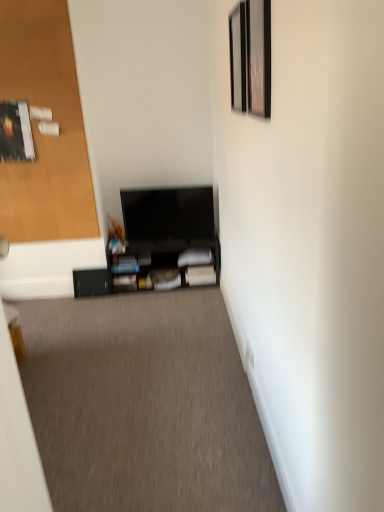
Measure the distance between wooden picture frame at upper right, placed as the 2th picture frame when sorted from front to back, and camera.

The distance of wooden picture frame at upper right, placed as the 2th picture frame when sorted from front to back, from camera is 1.82 meters.

This screenshot has height=512, width=384. Describe the element at coordinates (144, 405) in the screenshot. I see `black matte tv at center` at that location.

In order to face black matte tv at center, should I rotate leftwards or rightwards?

A 13.364 degree turn to the left will do.

The height and width of the screenshot is (512, 384). In order to click on metallic silver picture frame at upper right, acting as the 1th picture frame starting from the front in this screenshot , I will do `click(259, 57)`.

What do you see at coordinates (91, 283) in the screenshot?
I see `black matte shelf at lower center, which is the second shelf in right-to-left order` at bounding box center [91, 283].

You are a GUI agent. You are given a task and a screenshot of the screen. Output one action in this format:
    pyautogui.click(x=<x>, y=<y>)
    Task: Click on the black matte shelf at lower center, which is the second shelf in right-to-left order
    Image resolution: width=384 pixels, height=512 pixels.
    Given the screenshot: What is the action you would take?
    (91, 283)

Measure the distance between point (14, 13) and camera.

The distance of point (14, 13) from camera is 2.80 meters.

Identify the location of wooden picture frame at upper right, placed as the 2th picture frame when sorted from front to back. This screenshot has height=512, width=384. (238, 57).

How different are the orientations of black matte shelf at lower center, which is the second shelf in right-to-left order, and black matte tv at center in degrees?

They differ by 0.611 degrees in their facing directions.

Looking at their sizes, would you say black matte shelf at lower center, which is the second shelf in right-to-left order, is wider or thinner than black matte tv at center?

black matte shelf at lower center, which is the second shelf in right-to-left order, is thinner than black matte tv at center.

Which of these two, black matte shelf at lower center, which is the second shelf in right-to-left order, or black matte tv at center, stands taller?

Standing taller between the two is black matte shelf at lower center, which is the second shelf in right-to-left order.

This screenshot has width=384, height=512. What are the coordinates of `plain located below the black matte shelf at lower center, acting as the 1th shelf starting from the left (from the image's perspective)` in the screenshot? It's located at (144, 405).

Is wooden door at left with black matte shelf at lower center, acting as the 1th shelf starting from the left?

No, wooden door at left is not beside black matte shelf at lower center, acting as the 1th shelf starting from the left.

How different are the orientations of wooden door at left and black matte shelf at lower center, acting as the 1th shelf starting from the left, in degrees?

There is a 1.6-degree angle between the facing directions of wooden door at left and black matte shelf at lower center, acting as the 1th shelf starting from the left.

Which of these two, wooden door at left or black matte shelf at lower center, acting as the 1th shelf starting from the left, is wider?

black matte shelf at lower center, acting as the 1th shelf starting from the left.

Is wooden door at left taller or shorter than black matte shelf at lower center, which is the second shelf in right-to-left order?

Clearly, wooden door at left is taller compared to black matte shelf at lower center, which is the second shelf in right-to-left order.

Which is closer, [175,428] or [270,33]?

Point [270,33]

Between black matte tv at center and metallic silver picture frame at upper right, acting as the 1th picture frame starting from the front, which one appears on the right side from the viewer's perspective?

From the viewer's perspective, metallic silver picture frame at upper right, acting as the 1th picture frame starting from the front, appears more on the right side.

From a real-world perspective, which is physically below, black matte tv at center or metallic silver picture frame at upper right, acting as the 1th picture frame starting from the front?

black matte tv at center.

Which object is further away from the camera, black matte tv at center or metallic silver picture frame at upper right, acting as the 1th picture frame starting from the front?

black matte tv at center.

Is wooden door at left behind wooden picture frame at upper right, placed as the 2th picture frame when sorted from front to back?

Yes, it is.

From the picture: Is wooden door at left shorter than wooden picture frame at upper right, the 1th picture frame in the back-to-front sequence?

Incorrect, the height of wooden door at left does not fall short of that of wooden picture frame at upper right, the 1th picture frame in the back-to-front sequence.

Is point (30, 74) farther from camera compared to point (230, 27)?

Yes, point (30, 74) is behind point (230, 27).

From the image's perspective, between wooden door at left and wooden picture frame at upper right, placed as the 2th picture frame when sorted from front to back, which one is located above?

wooden door at left appears higher in the image.

From their relative heights in the image, would you say wooden picture frame at upper right, the 1th picture frame in the back-to-front sequence, is taller or shorter than black matte shelf at lower center, which is the second shelf in right-to-left order?

In the image, wooden picture frame at upper right, the 1th picture frame in the back-to-front sequence, appears to be taller than black matte shelf at lower center, which is the second shelf in right-to-left order.

In terms of width, does wooden picture frame at upper right, placed as the 2th picture frame when sorted from front to back, look wider or thinner when compared to black matte shelf at lower center, which is the second shelf in right-to-left order?

Clearly, wooden picture frame at upper right, placed as the 2th picture frame when sorted from front to back, has less width compared to black matte shelf at lower center, which is the second shelf in right-to-left order.

From the image's perspective, is wooden picture frame at upper right, the 1th picture frame in the back-to-front sequence, located beneath black matte shelf at lower center, acting as the 1th shelf starting from the left?

No.

Considering the relative positions of matte black shelf at center, arranged as the 2th shelf when viewed from the left, and wooden door at left in the image provided, is matte black shelf at center, arranged as the 2th shelf when viewed from the left, to the left or to the right of wooden door at left?

matte black shelf at center, arranged as the 2th shelf when viewed from the left, is to the right of wooden door at left.

From the image's perspective, which is above, matte black shelf at center, which is the 1th shelf in right-to-left order, or wooden door at left?

From the image's view, wooden door at left is above.

Is matte black shelf at center, arranged as the 2th shelf when viewed from the left, oriented towards wooden door at left?

No, matte black shelf at center, arranged as the 2th shelf when viewed from the left, is not facing towards wooden door at left.

Considering the relative sizes of matte black shelf at center, which is the 1th shelf in right-to-left order, and wooden door at left in the image provided, is matte black shelf at center, which is the 1th shelf in right-to-left order, taller than wooden door at left?

No.

What's the angular difference between metallic silver picture frame at upper right, placed as the 2th picture frame when sorted from back to front, and wooden picture frame at upper right, the 1th picture frame in the back-to-front sequence,'s facing directions?

The angle between the facing direction of metallic silver picture frame at upper right, placed as the 2th picture frame when sorted from back to front, and the facing direction of wooden picture frame at upper right, the 1th picture frame in the back-to-front sequence, is 0.0146 degrees.

Are metallic silver picture frame at upper right, acting as the 1th picture frame starting from the front, and wooden picture frame at upper right, the 1th picture frame in the back-to-front sequence, located far from each other?

No, metallic silver picture frame at upper right, acting as the 1th picture frame starting from the front, is in close proximity to wooden picture frame at upper right, the 1th picture frame in the back-to-front sequence.

Is metallic silver picture frame at upper right, placed as the 2th picture frame when sorted from back to front, facing towards wooden picture frame at upper right, the 1th picture frame in the back-to-front sequence?

No.

This screenshot has width=384, height=512. Identify the location of shelf on the left side of black matte tv at center. (91, 283).

This screenshot has width=384, height=512. Identify the location of door in front of the black matte shelf at lower center, which is the second shelf in right-to-left order. (38, 130).

Which object lies nearer to the anchor point wooden door at left, black matte shelf at lower center, acting as the 1th shelf starting from the left, or matte black shelf at center, which is the 1th shelf in right-to-left order?

The object closer to wooden door at left is matte black shelf at center, which is the 1th shelf in right-to-left order.

From the image, which object appears to be farther from wooden door at left, black matte shelf at lower center, which is the second shelf in right-to-left order, or wooden picture frame at upper right, placed as the 2th picture frame when sorted from front to back?

Based on the image, wooden picture frame at upper right, placed as the 2th picture frame when sorted from front to back, appears to be further to wooden door at left.

From the image, which object appears to be nearer to black matte shelf at lower center, acting as the 1th shelf starting from the left, matte black shelf at center, which is the 1th shelf in right-to-left order, or metallic silver picture frame at upper right, placed as the 2th picture frame when sorted from back to front?

matte black shelf at center, which is the 1th shelf in right-to-left order, lies closer to black matte shelf at lower center, acting as the 1th shelf starting from the left, than the other object.

Based on their spatial positions, is black matte shelf at lower center, acting as the 1th shelf starting from the left, or wooden picture frame at upper right, placed as the 2th picture frame when sorted from front to back, closer to black matte tv at center?

black matte shelf at lower center, acting as the 1th shelf starting from the left.

Which object lies further to the anchor point black matte tv at center, wooden door at left or black matte shelf at lower center, acting as the 1th shelf starting from the left?

wooden door at left lies further to black matte tv at center than the other object.

Estimate the real-world distances between objects in this image. Which object is further from wooden door at left, metallic silver picture frame at upper right, acting as the 1th picture frame starting from the front, or black matte shelf at lower center, which is the second shelf in right-to-left order?

metallic silver picture frame at upper right, acting as the 1th picture frame starting from the front, lies further to wooden door at left than the other object.

When comparing their distances from matte black shelf at center, arranged as the 2th shelf when viewed from the left, does black matte tv at center or black matte shelf at lower center, which is the second shelf in right-to-left order, seem closer?

The object closer to matte black shelf at center, arranged as the 2th shelf when viewed from the left, is black matte shelf at lower center, which is the second shelf in right-to-left order.

Estimate the real-world distances between objects in this image. Which object is further from wooden picture frame at upper right, placed as the 2th picture frame when sorted from front to back, metallic silver picture frame at upper right, placed as the 2th picture frame when sorted from back to front, or black matte tv at center?

black matte tv at center is positioned further to the anchor wooden picture frame at upper right, placed as the 2th picture frame when sorted from front to back.

Identify the location of shelf between wooden door at left and black matte shelf at lower center, acting as the 1th shelf starting from the left, from top to bottom. (166, 265).

Identify the location of picture frame between wooden door at left and metallic silver picture frame at upper right, acting as the 1th picture frame starting from the front. Image resolution: width=384 pixels, height=512 pixels. (238, 57).

Locate an element on the screen. door positioned between black matte tv at center and matte black shelf at center, arranged as the 2th shelf when viewed from the left, from near to far is located at coordinates click(x=38, y=130).

Where is `shelf between wooden picture frame at upper right, placed as the 2th picture frame when sorted from front to back, and black matte shelf at lower center, acting as the 1th shelf starting from the left, in the front-back direction`? The width and height of the screenshot is (384, 512). shelf between wooden picture frame at upper right, placed as the 2th picture frame when sorted from front to back, and black matte shelf at lower center, acting as the 1th shelf starting from the left, in the front-back direction is located at coordinates (166, 265).